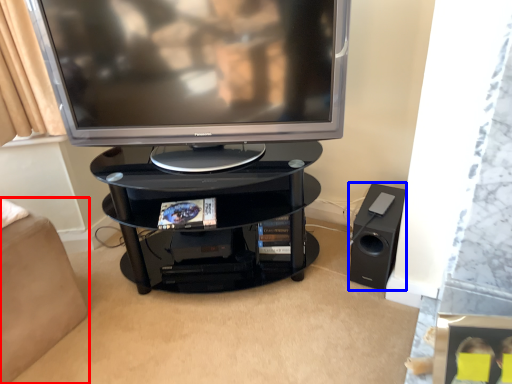
Question: Which object appears closest to the camera in this image, furniture (highlighted by a red box) or speaker (highlighted by a blue box)?

Choices:
 (A) furniture
 (B) speaker

Answer: (A)